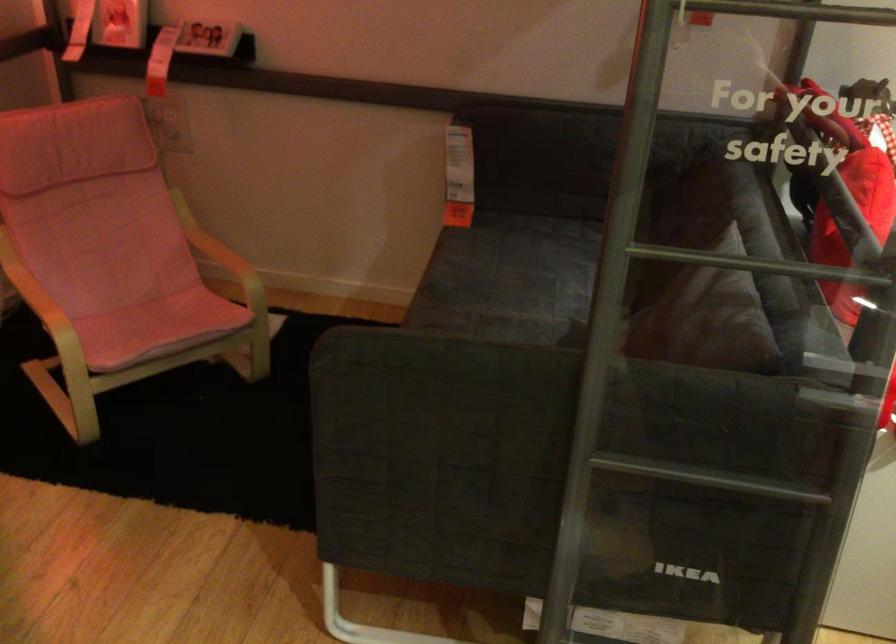
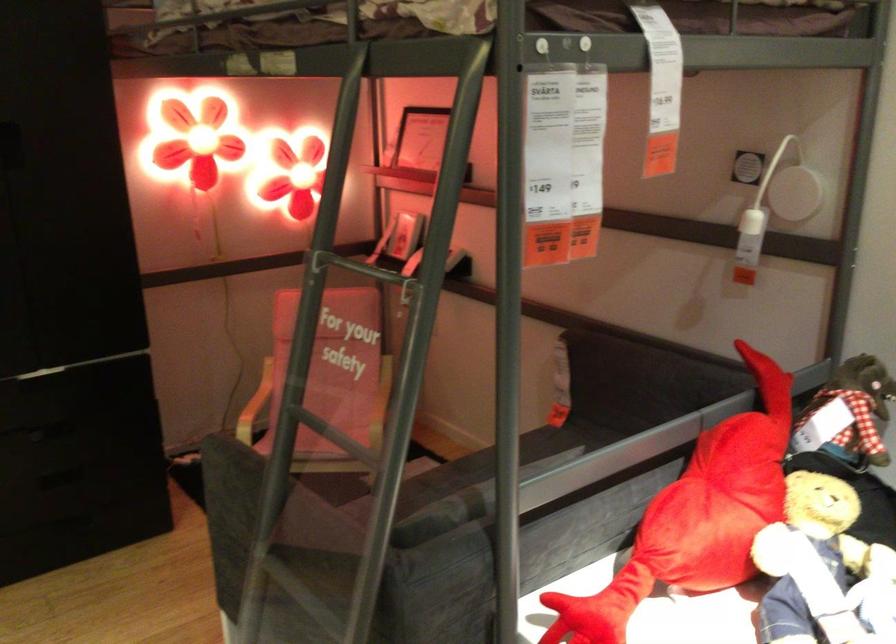
Question: I am providing you with two images of the same scene from different viewpoints. Which of the following objects are not visible in image2?

Choices:
 (A) grey sofa sitting surface
 (B) dark sofa sitting surface
 (C) white lamp switch
 (D) book with white spine

Answer: (A)